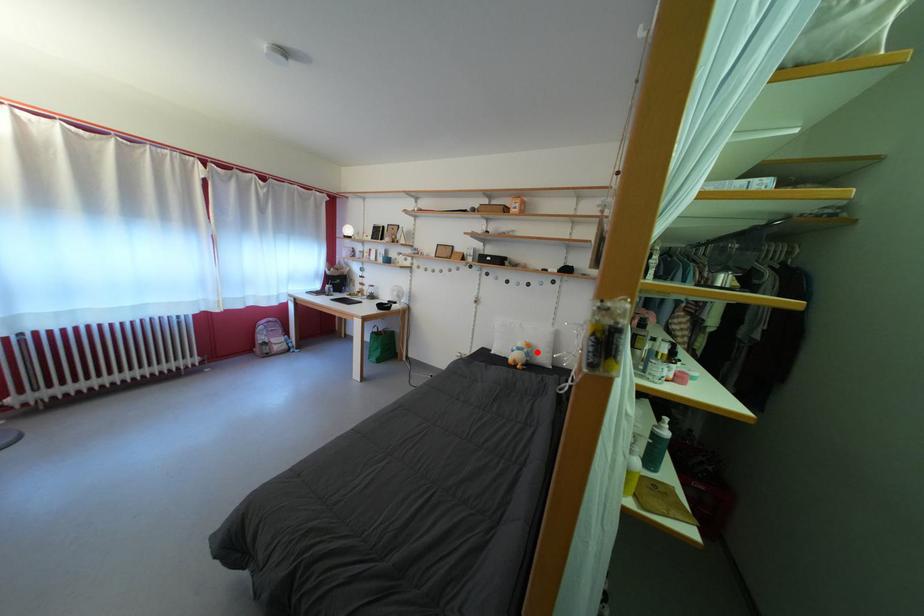
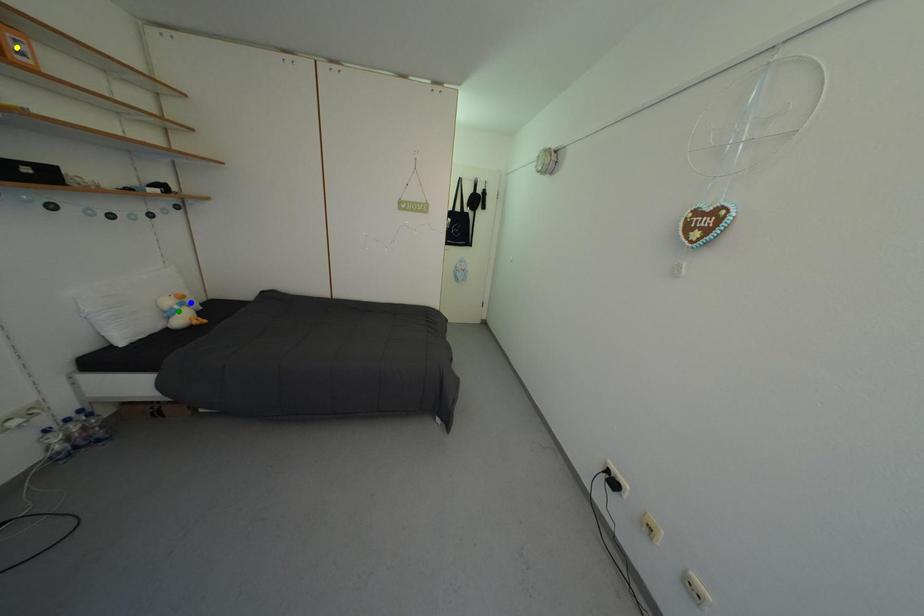
Question: I am providing you with two images of the same scene from different viewpoints. A red point is marked on the first image. You are given multiple points on the second image. Which point in image 2 is actually the same real-world point as the red point in image 1?

Choices:
 (A) blue point
 (B) yellow point
 (C) green point

Answer: (A)